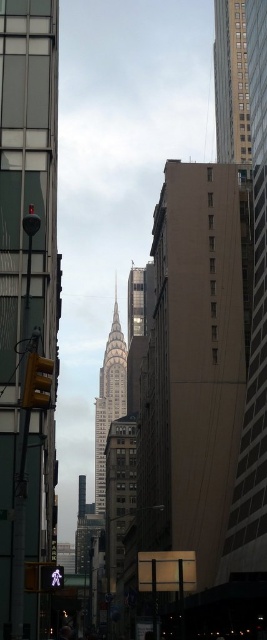
Question: Does reflective glass skyscraper at upper right have a smaller size compared to gray stone tower at center?

Choices:
 (A) yes
 (B) no

Answer: (A)

Question: Is reflective glass skyscraper at upper right smaller than gray stone tower at center?

Choices:
 (A) yes
 (B) no

Answer: (A)

Question: Which point is closer to the camera?

Choices:
 (A) (123, 401)
 (B) (5, 595)

Answer: (B)

Question: Among these objects, which one is nearest to the camera?

Choices:
 (A) matte glass skyscraper at center
 (B) gray stone tower at center
 (C) reflective glass skyscraper at upper right

Answer: (A)

Question: Which object is the closest to the gray stone tower at center?

Choices:
 (A) reflective glass skyscraper at upper right
 (B) matte glass skyscraper at center

Answer: (A)

Question: Is matte glass skyscraper at center below reflective glass skyscraper at upper right?

Choices:
 (A) yes
 (B) no

Answer: (A)